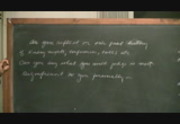
Identify the location of green area on chalkboard with no writing. The height and width of the screenshot is (124, 180). (93, 94), (152, 91), (50, 93).